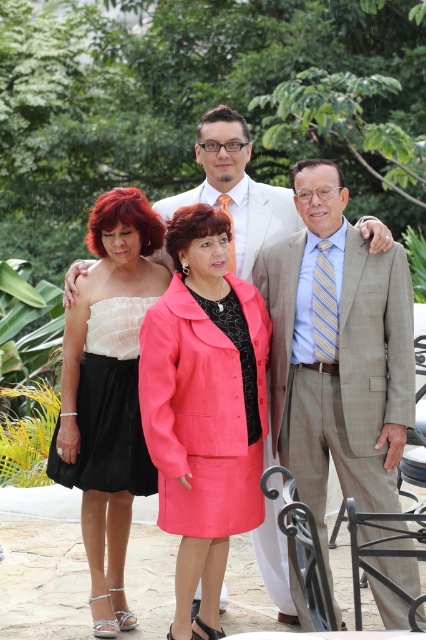
Question: Does beige textured suit at right appear on the right side of light brown textured suit at center?

Choices:
 (A) yes
 (B) no

Answer: (A)

Question: Which point is closer to the camera?

Choices:
 (A) light brown textured suit at center
 (B) coral fabric coat at center
 (C) matte white strapless top at left
 (D) black satin skirt at lower left

Answer: (B)

Question: Can you confirm if light brown textured suit at center is wider than black satin skirt at lower left?

Choices:
 (A) yes
 (B) no

Answer: (A)

Question: Is light brown textured suit at center positioned behind black satin skirt at lower left?

Choices:
 (A) no
 (B) yes

Answer: (B)

Question: Which point is farther to the camera?

Choices:
 (A) (126, 440)
 (B) (109, 422)
 (C) (66, 276)

Answer: (C)

Question: Which object is positioned farthest from the coral fabric coat at center?

Choices:
 (A) beige textured suit at right
 (B) matte white strapless top at left
 (C) black satin skirt at lower left
 (D) light brown textured suit at center

Answer: (D)